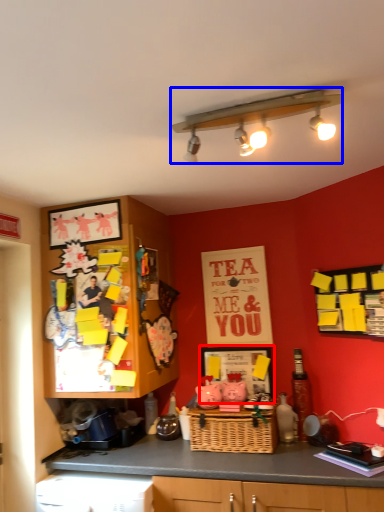
Question: Which of the following is the farthest to the observer, picture frame (highlighted by a red box) or light fixture (highlighted by a blue box)?

Choices:
 (A) picture frame
 (B) light fixture

Answer: (A)